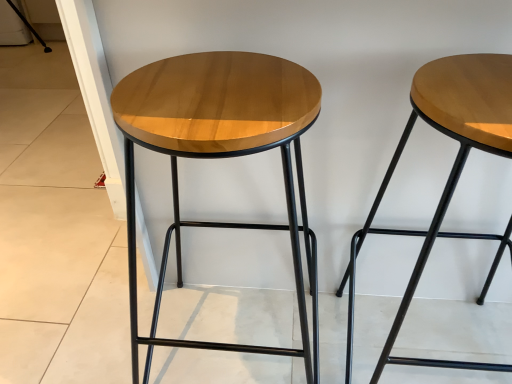
Question: Does wooden stool at center, arranged as the first stool when viewed from the left, have a lesser width compared to wooden stool at upper right, acting as the 2th stool starting from the left?

Choices:
 (A) no
 (B) yes

Answer: (A)

Question: Can you confirm if wooden stool at center, arranged as the first stool when viewed from the left, is bigger than wooden stool at upper right, the 1th stool from the right?

Choices:
 (A) no
 (B) yes

Answer: (B)

Question: Are wooden stool at center, the 2th stool from the right, and wooden stool at upper right, the 1th stool from the right, located far from each other?

Choices:
 (A) no
 (B) yes

Answer: (A)

Question: Is wooden stool at upper right, acting as the 2th stool starting from the left, located within wooden stool at center, arranged as the first stool when viewed from the left?

Choices:
 (A) no
 (B) yes

Answer: (A)

Question: Is wooden stool at center, arranged as the first stool when viewed from the left, wider than wooden stool at upper right, the 1th stool from the right?

Choices:
 (A) yes
 (B) no

Answer: (A)

Question: Does wooden stool at center, arranged as the first stool when viewed from the left, appear on the left side of wooden stool at upper right, acting as the 2th stool starting from the left?

Choices:
 (A) yes
 (B) no

Answer: (A)

Question: Could you tell me if wooden stool at upper right, acting as the 2th stool starting from the left, is facing wooden stool at center, arranged as the first stool when viewed from the left?

Choices:
 (A) yes
 (B) no

Answer: (B)

Question: Can you confirm if wooden stool at upper right, the 1th stool from the right, is positioned to the right of wooden stool at center, arranged as the first stool when viewed from the left?

Choices:
 (A) yes
 (B) no

Answer: (A)

Question: Can you see wooden stool at upper right, the 1th stool from the right, touching wooden stool at center, the 2th stool from the right?

Choices:
 (A) no
 (B) yes

Answer: (A)

Question: Considering the relative sizes of wooden stool at upper right, acting as the 2th stool starting from the left, and wooden stool at center, the 2th stool from the right, in the image provided, is wooden stool at upper right, acting as the 2th stool starting from the left, wider than wooden stool at center, the 2th stool from the right,?

Choices:
 (A) no
 (B) yes

Answer: (A)

Question: From the image's perspective, is wooden stool at upper right, acting as the 2th stool starting from the left, on wooden stool at center, the 2th stool from the right?

Choices:
 (A) no
 (B) yes

Answer: (A)

Question: Is wooden stool at upper right, acting as the 2th stool starting from the left, behind wooden stool at center, arranged as the first stool when viewed from the left?

Choices:
 (A) no
 (B) yes

Answer: (A)

Question: From a real-world perspective, is wooden stool at center, arranged as the first stool when viewed from the left, positioned above or below wooden stool at upper right, the 1th stool from the right?

Choices:
 (A) above
 (B) below

Answer: (A)